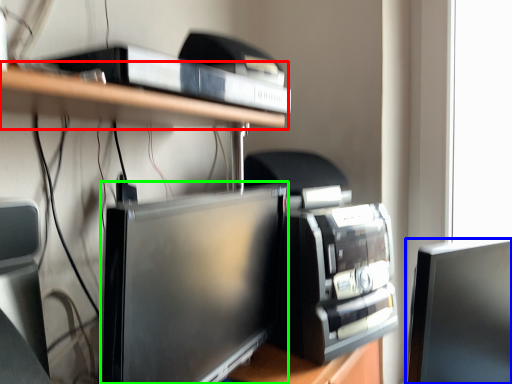
Question: Which object is the farthest from shelf (highlighted by a red box)? Choose among these: computer monitor (highlighted by a blue box) or computer monitor (highlighted by a green box).

Choices:
 (A) computer monitor
 (B) computer monitor

Answer: (A)